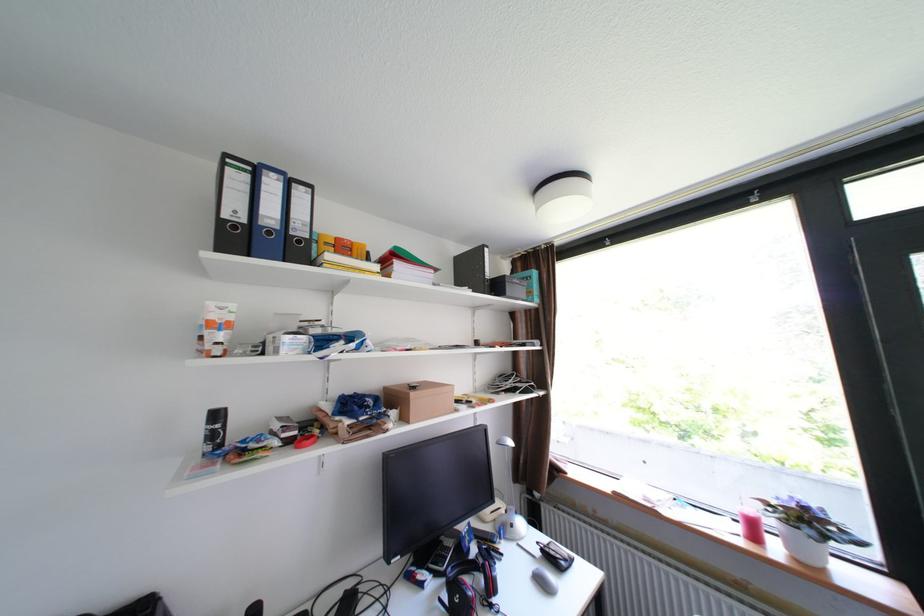
Find the location of a particular element. This screenshot has height=616, width=924. white flower pot is located at coordinates (804, 546).